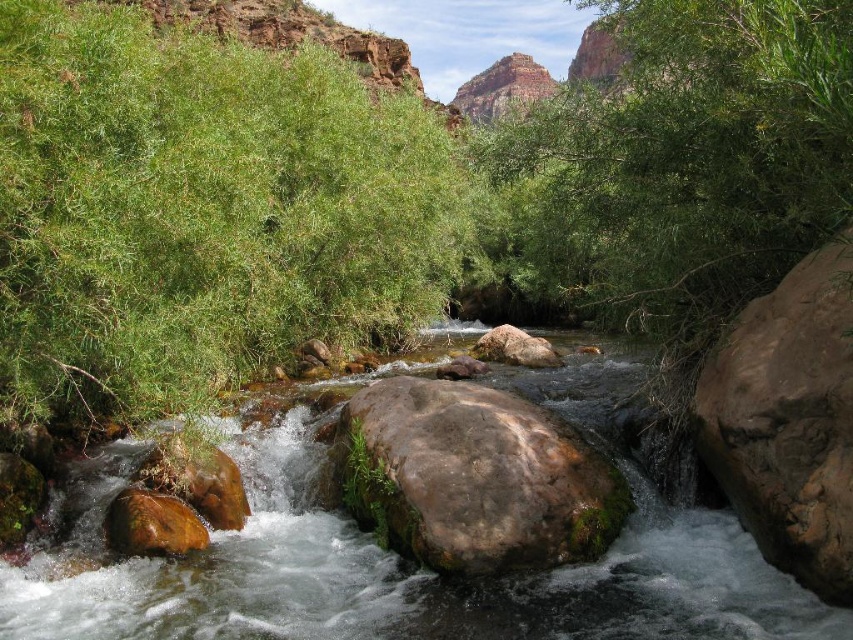
You are standing at the edge of the stream in the scene. There is a point marked at coordinates (x=392, y=572). What is located at this point?

The point at coordinates (x=392, y=572) corresponds to clear water at center.

You are standing at the edge of the stream and want to reach a point marked as point (753, 412). There is another point marked as point (502, 332) further away. Which point is closer to you, the observer?

Point (753, 412) is closer to you than point (502, 332) because it is nearer to the camera position.